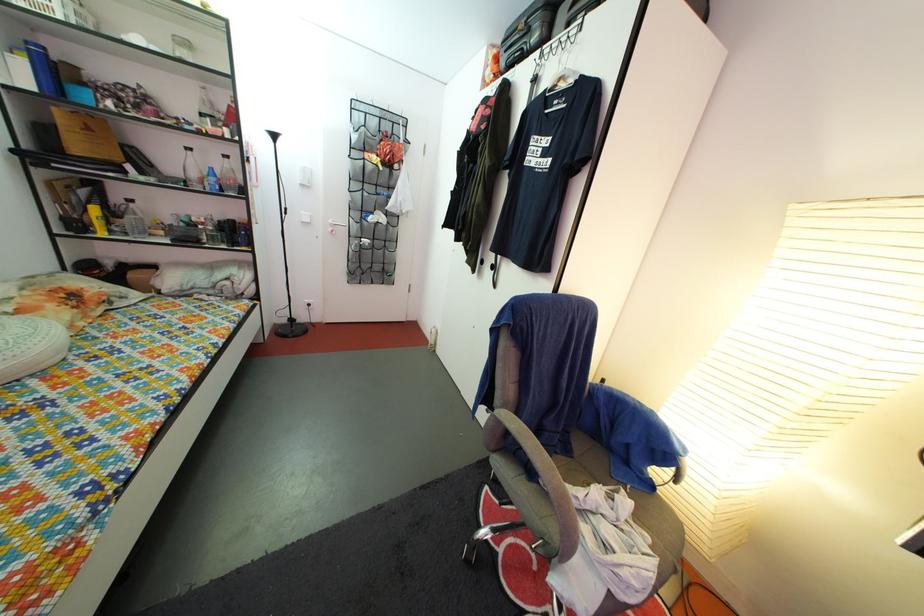
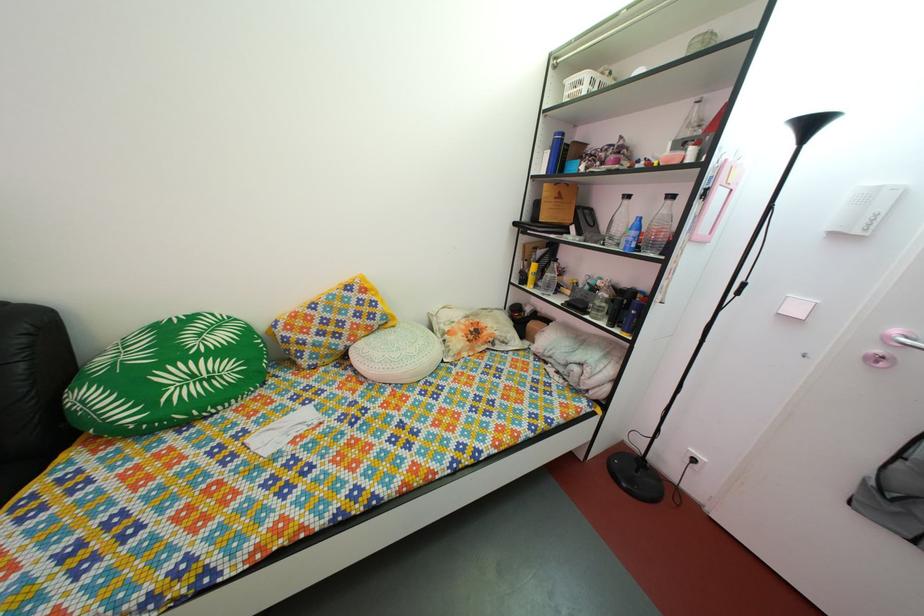
The point at (169, 182) is marked in the first image. Where is the corresponding point in the second image?

(608, 241)